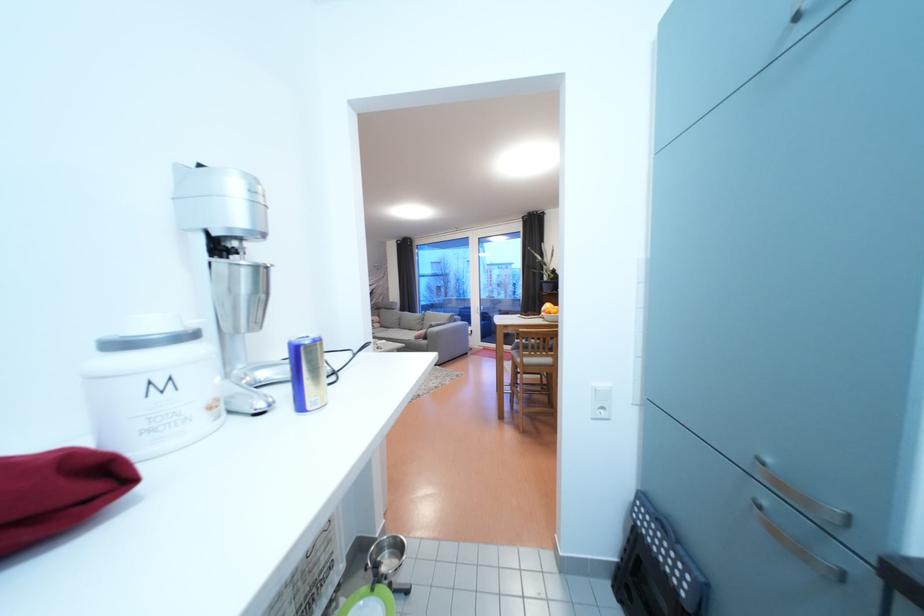
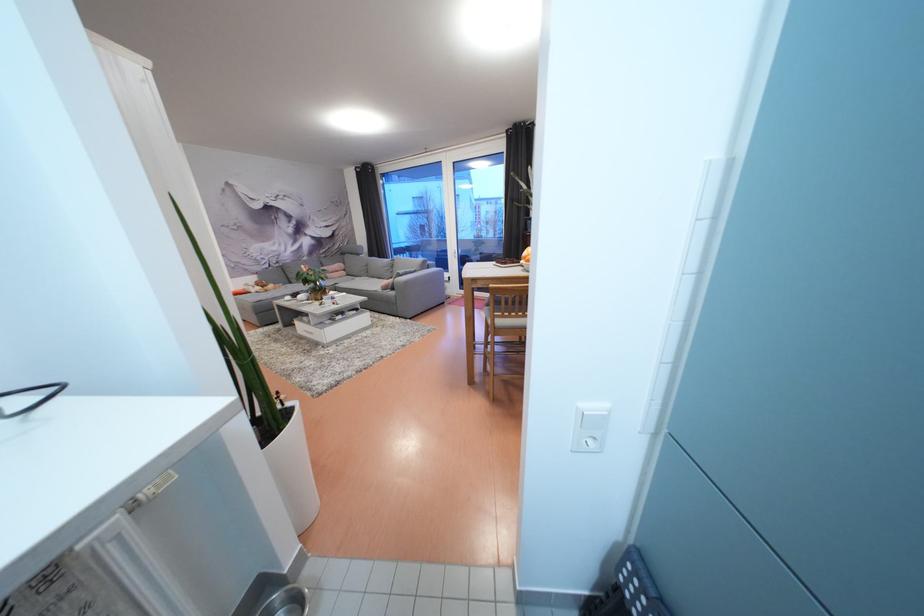
Question: How did the camera likely rotate?

Choices:
 (A) Left
 (B) Right
 (C) Up
 (D) Down

Answer: (D)